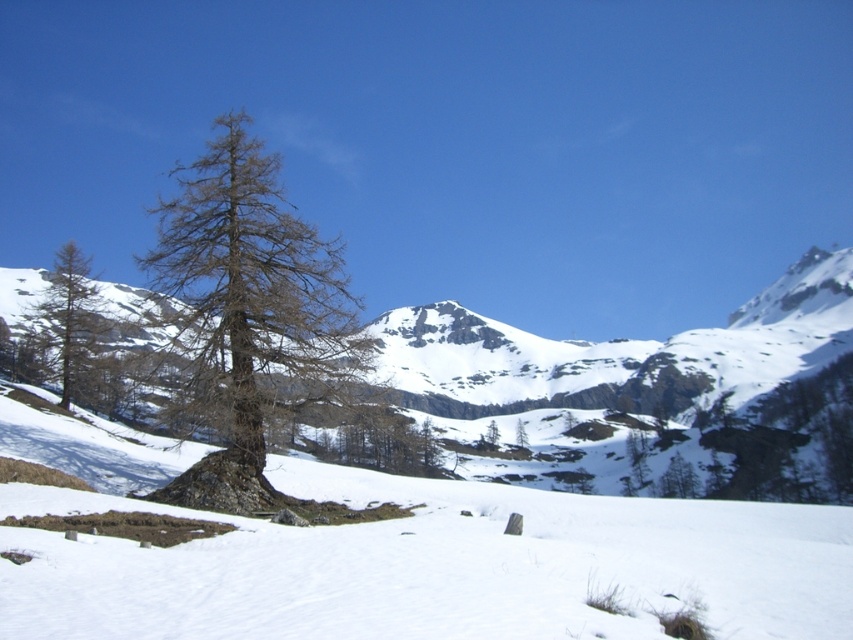
Which of these two, brown/driedtree at left or brown matte tree at left, stands shorter?

brown matte tree at left is shorter.

The height and width of the screenshot is (640, 853). I want to click on brown/driedtree at left, so click(248, 310).